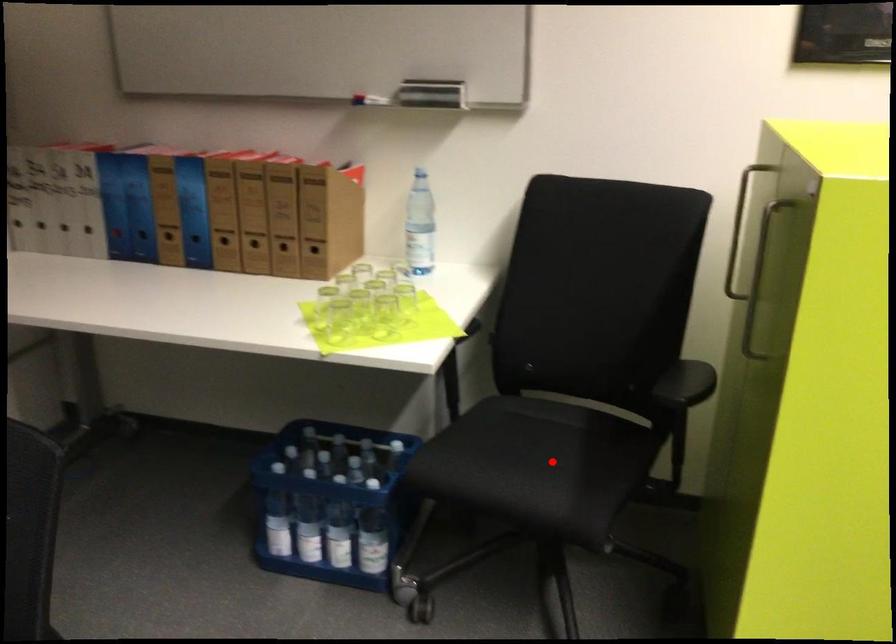
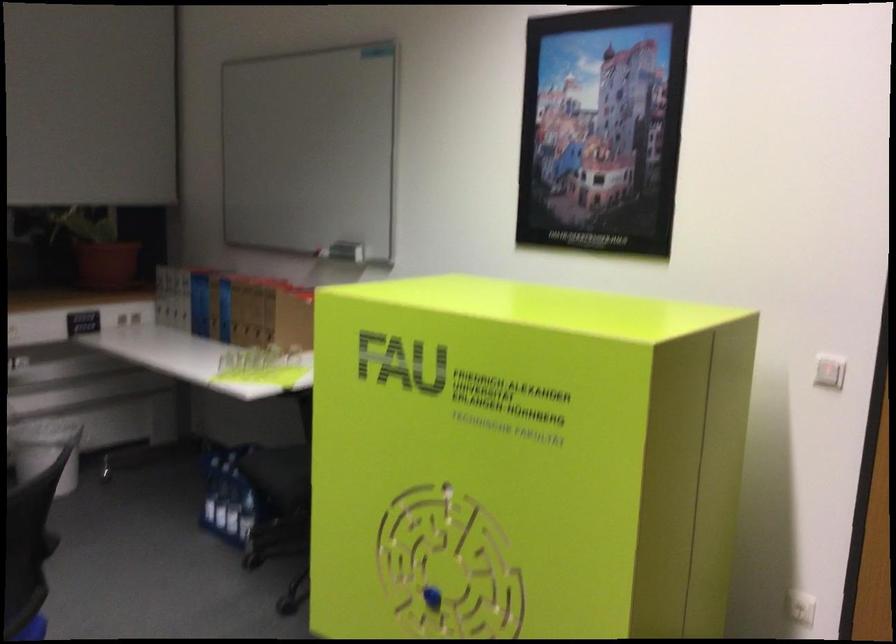
Question: I am providing you with two images of the same scene from different viewpoints. A red point is marked on the first image. Can you still see the location of the red point in image 2?

Choices:
 (A) Yes
 (B) No

Answer: (B)